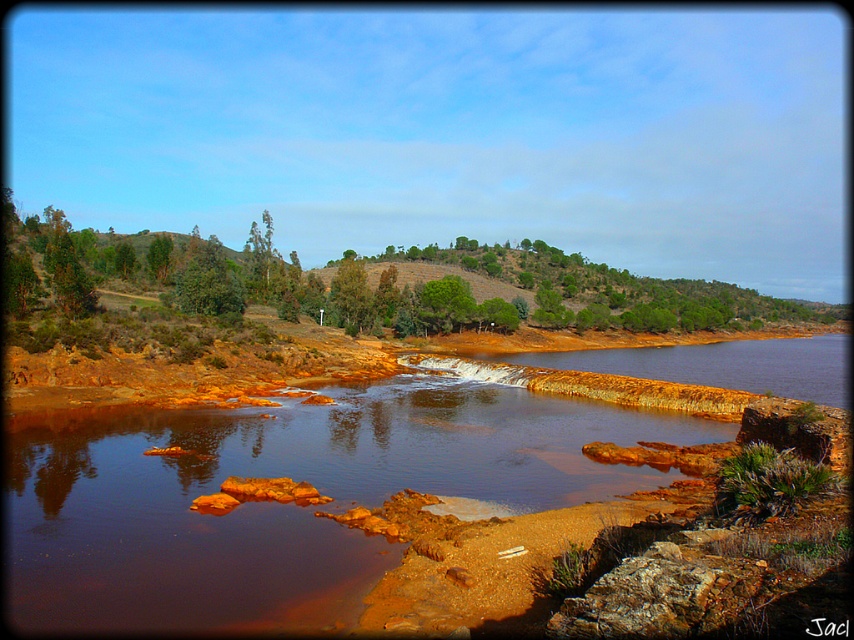
In the scene shown: Does brown rock at center have a lesser height compared to green matte tree at center?

Indeed, brown rock at center has a lesser height compared to green matte tree at center.

Is brown rock at center wider than green matte tree at center?

Yes, brown rock at center is wider than green matte tree at center.

Which is in front, point (776, 362) or point (338, 300)?

Positioned in front is point (776, 362).

Where is `brown rock at center`? Image resolution: width=854 pixels, height=640 pixels. brown rock at center is located at coordinates (723, 365).

Is brown sedimentary rock at center in front of green matte tree at center?

Yes, brown sedimentary rock at center is in front of green matte tree at center.

Does point (192, 596) come in front of point (330, 289)?

That is True.

What are the coordinates of `brown sedimentary rock at center` in the screenshot? It's located at (284, 504).

Does brown sedimentary rock at center have a greater height compared to brown rock at center?

No.

Image resolution: width=854 pixels, height=640 pixels. Identify the location of brown sedimentary rock at center. (284, 504).

Where is `brown sedimentary rock at center`? brown sedimentary rock at center is located at coordinates (284, 504).